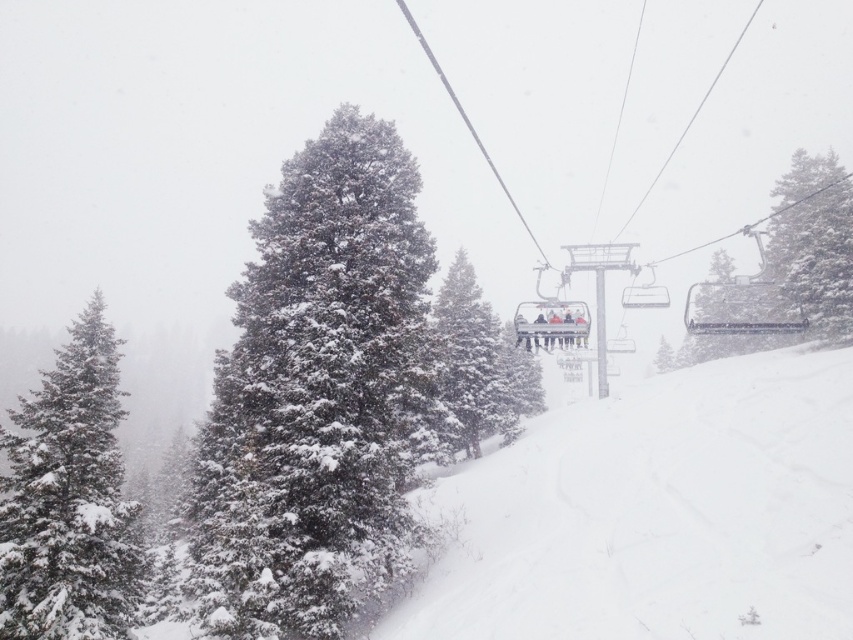
Question: In this image, where is snow-covered evergreen at left located relative to green textured pine tree at upper right?

Choices:
 (A) left
 (B) right

Answer: (A)

Question: Does white snow at center have a lesser width compared to snow-covered pine at center?

Choices:
 (A) yes
 (B) no

Answer: (B)

Question: Is snow-covered evergreen at center below green textured pine tree at upper right?

Choices:
 (A) yes
 (B) no

Answer: (A)

Question: Which object is closer to the camera taking this photo?

Choices:
 (A) snow-covered pine at center
 (B) snow-covered evergreen at left
 (C) green textured pine at center

Answer: (B)

Question: Among these objects, which one is farthest from the camera?

Choices:
 (A) snow-covered pine at center
 (B) snow-covered evergreen at left
 (C) snow-covered evergreen at center
 (D) green textured pine at center

Answer: (A)

Question: Considering the real-world distances, which object is closest to the white snow at center?

Choices:
 (A) green textured pine at center
 (B) green textured pine tree at upper right

Answer: (B)